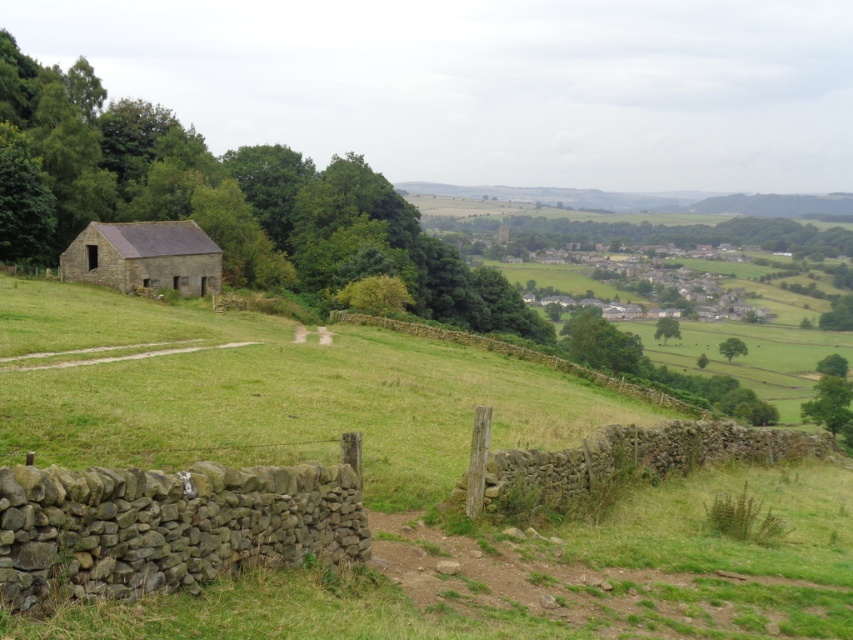
Question: Which of the following is the closest to the observer?

Choices:
 (A) click(x=741, y=436)
 (B) click(x=666, y=394)

Answer: (A)

Question: In this image, where is brown stone wall at lower left located relative to dry stone wall at center?

Choices:
 (A) right
 (B) left

Answer: (B)

Question: Can you confirm if brown stone wall at lower center is positioned to the right of dry stone wall at center?

Choices:
 (A) no
 (B) yes

Answer: (B)

Question: Which object is the closest to the brown stone wall at lower center?

Choices:
 (A) brown stone wall at lower left
 (B) rustic stone barn at lower left

Answer: (A)

Question: Which point is farther to the camera?

Choices:
 (A) 451,330
 (B) 96,468
 (C) 718,445
 (D) 123,276

Answer: (A)

Question: Does brown stone wall at lower center appear over rustic stone barn at lower left?

Choices:
 (A) yes
 (B) no

Answer: (B)